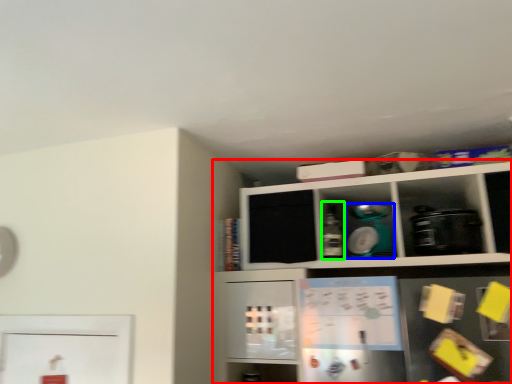
Question: Considering the real-world distances, which object is closest to shelf (highlighted by a red box)? appliance (highlighted by a blue box) or bottle (highlighted by a green box).

Choices:
 (A) appliance
 (B) bottle

Answer: (A)